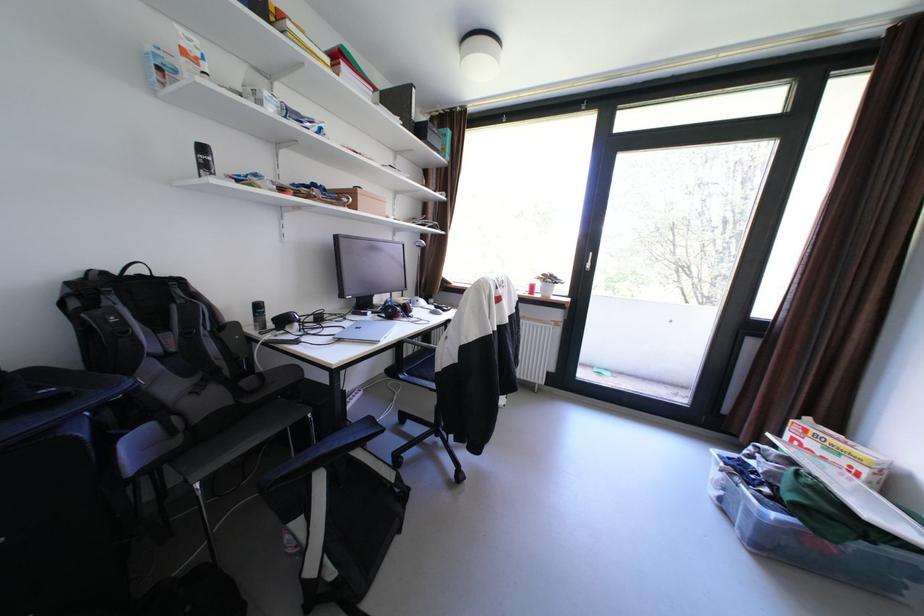
You are a GUI agent. You are given a task and a screenshot of the screen. Output one action in this format:
    pyautogui.click(x=<x>, y=<y>)
    Task: Click on the silver door handle
    The image size is (924, 616).
    Given the screenshot: What is the action you would take?
    pyautogui.click(x=589, y=261)